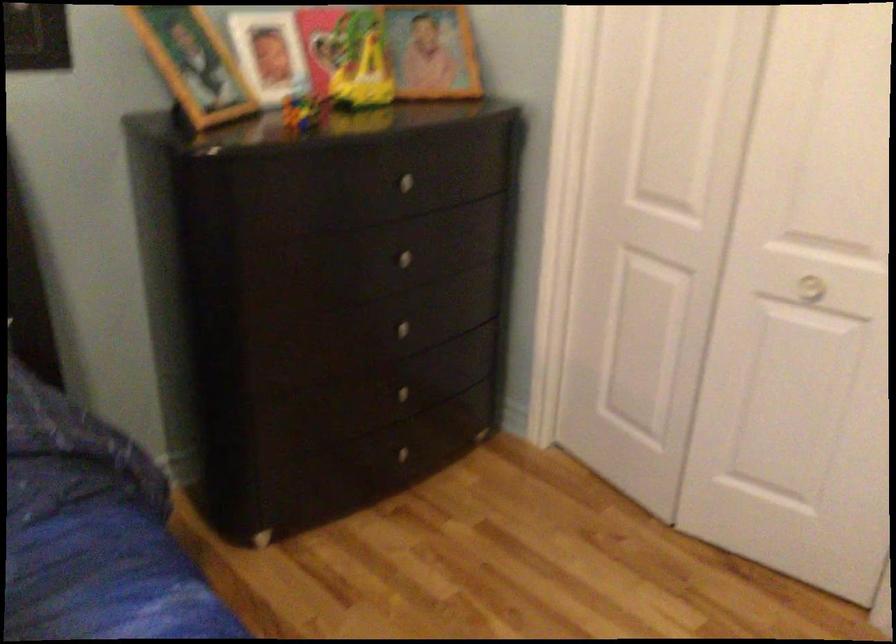
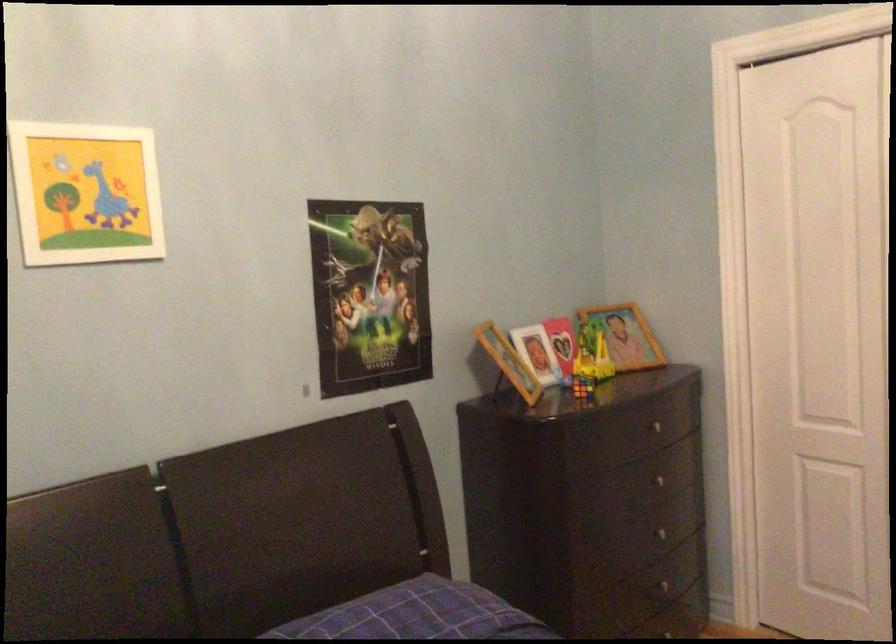
Where in the second image is the point corresponding to pixel 297 111 from the first image?

(582, 386)